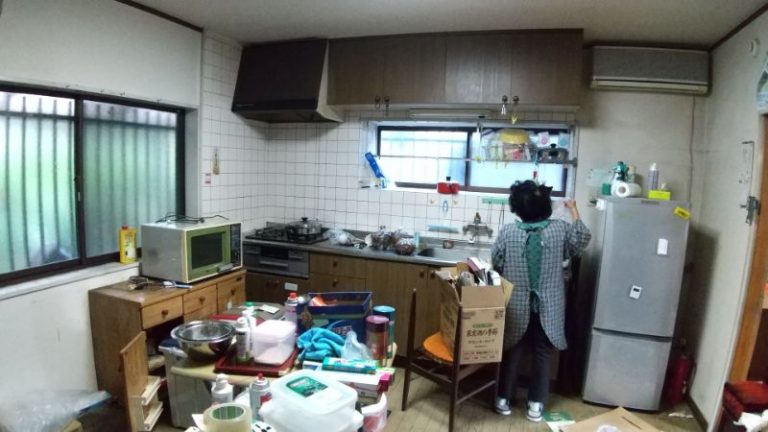
Locate an element on the screen. Image resolution: width=768 pixels, height=432 pixels. drawer is located at coordinates (169, 312).